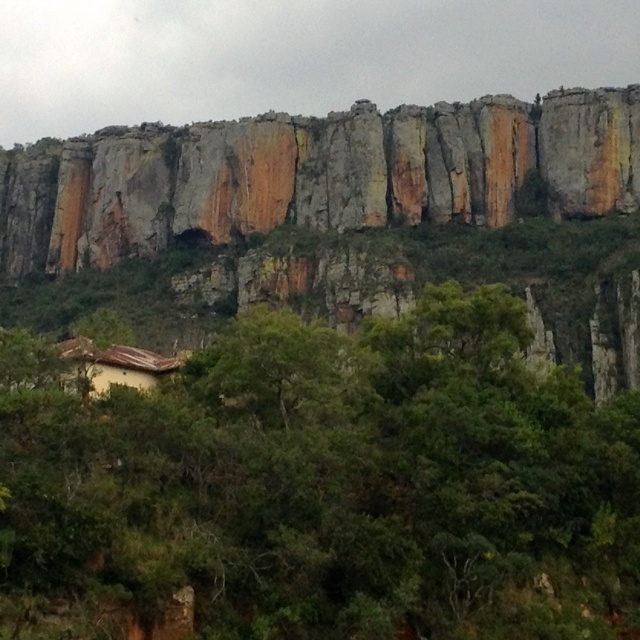
Who is lower down, green leafy tree at center or rustic stone cliff at upper center?

Positioned lower is green leafy tree at center.

Between green leafy tree at center and rustic stone cliff at upper center, which one appears on the left side from the viewer's perspective?

Positioned to the left is rustic stone cliff at upper center.

Who is more forward, (257, 388) or (618, 202)?

Point (257, 388)

Image resolution: width=640 pixels, height=640 pixels. I want to click on green leafy tree at center, so click(x=333, y=481).